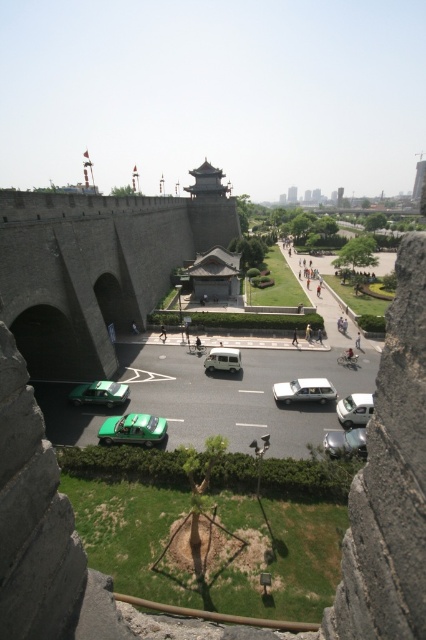
You are a delivery driver who needs to park your vehicle in a spot that can accommodate larger vehicles. Based on the scene, which vehicle among the green matte car at lower center and the white matte van at center would require a bigger parking space?

The green matte car at lower center requires a bigger parking space because it is larger in size compared to the white matte van at center.

You are a delivery driver trying to park your green matte car at lower center in a tight space near the green matte car at center. Based on the scene, which car should you maneuver first to ensure proper parking?

The green matte car at lower center is bigger than the green matte car at center, so you should maneuver the green matte car at lower center first to accommodate its larger size in the tight space.

You are a drone operator trying to capture aerial footage of the green matte car at lower center and the white matte van at center. Since the drone has a limited field of view, you need to know if you can see both vehicles at the same time. Based on their positions, can you capture both in one shot?

The green matte car at lower center is positioned under the white matte van at center, so they are stacked vertically. Depending on the drone camera angle, it might be possible to capture both in one shot if the field of view includes the vertical space between them. However, if the van is directly blocking the car from above, the car might be obscured.